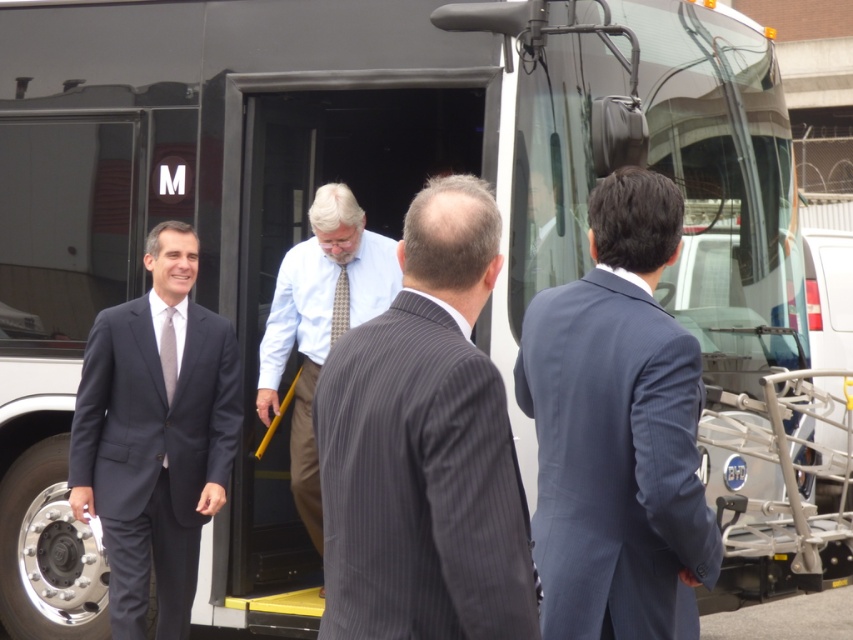
Question: Can you confirm if blue pinstripe suit at center is thinner than checkered fabric tie at center?

Choices:
 (A) no
 (B) yes

Answer: (A)

Question: Can you confirm if matte silver tie at left is thinner than checkered fabric tie at center?

Choices:
 (A) yes
 (B) no

Answer: (A)

Question: Which point is closer to the camera?

Choices:
 (A) checkered fabric tie at center
 (B) gray pinstripe suit at center
 (C) dark blue suit at left
 (D) matte silver tie at left

Answer: (B)

Question: Considering the real-world distances, which object is farthest from the gray pinstripe suit at center?

Choices:
 (A) light blue shirt with tie at center
 (B) blue pinstripe suit at center
 (C) dark blue suit at center
 (D) matte silver tie at left

Answer: (A)

Question: Does blue pinstripe suit at center appear on the left side of checkered fabric tie at center?

Choices:
 (A) yes
 (B) no

Answer: (B)

Question: Which is farther from the matte silver tie at left?

Choices:
 (A) dark blue suit at left
 (B) checkered fabric tie at center
 (C) dark blue suit at center
 (D) light blue shirt with tie at center

Answer: (C)